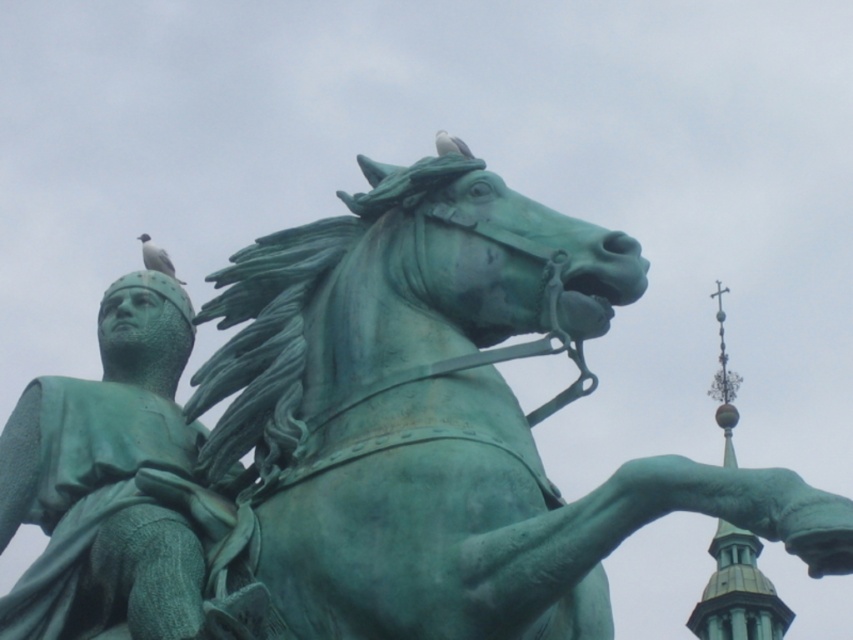
You are standing in front of the equestrian statue and want to take a photo that includes both the green patinated metal horse at center and the green copper tower at upper right. Which object should be positioned closer to the camera to ensure both are in focus?

The green patinated metal horse at center is in front of the green copper tower at upper right, so positioning the camera closer to the horse will ensure both are in focus since it is nearer to the camera than the tower.

Looking at this image, you are an art student analyzing the statue and its surroundings. You notice the green patinated metal horse at center and the white matte bird at upper left. Which object would appear closer to you in the image?

The green patinated metal horse at center appears closer because it is larger in size than the white matte bird at upper left, which is smaller and positioned further away.